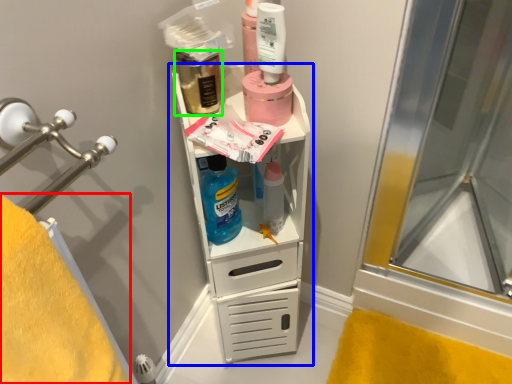
Question: Considering the real-world distances, which object is closest to bath towel (highlighted by a red box)? bathroom cabinet (highlighted by a blue box) or mouthwash (highlighted by a green box).

Choices:
 (A) bathroom cabinet
 (B) mouthwash

Answer: (A)